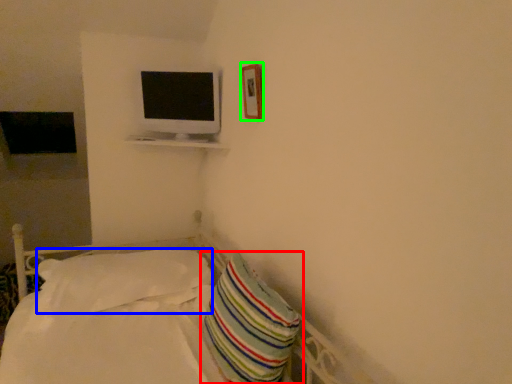
Question: Which object is positioned closest to pillow (highlighted by a red box)? Select from pillow (highlighted by a blue box) and picture frame (highlighted by a green box).

Choices:
 (A) pillow
 (B) picture frame

Answer: (A)